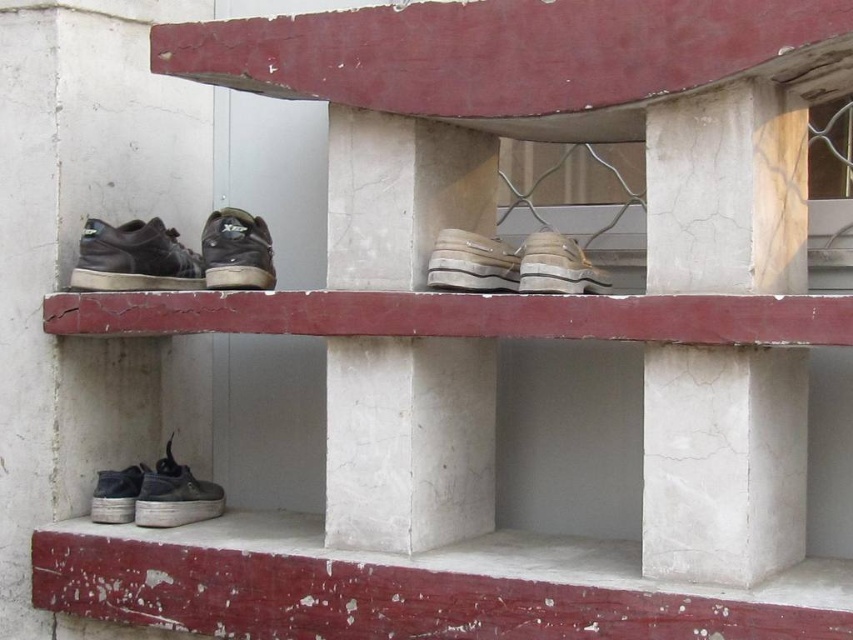
Between point (161, 250) and point (167, 524), which one is positioned behind?

Point (161, 250)

Consider the image. Is matte black shoe at left smaller than shiny black shoe at lower left?

No, matte black shoe at left is not smaller than shiny black shoe at lower left.

Between point (161, 269) and point (171, 516), which one is positioned in front?

Point (171, 516)

The image size is (853, 640). What are the coordinates of `matte black shoe at left` in the screenshot? It's located at (134, 259).

Can you confirm if worn leather shoe at center is smaller than shiny black shoe at lower left?

Yes, worn leather shoe at center is smaller than shiny black shoe at lower left.

Between worn leather shoe at center and shiny black shoe at lower left, which one has more height?

shiny black shoe at lower left

Which is behind, point (467, 275) or point (198, 508)?

Positioned behind is point (198, 508).

Find the location of `worn leather shoe at center`. worn leather shoe at center is located at coordinates (473, 262).

Is worn leather shoe at center shorter than dark gray suede shoe at lower left?

Incorrect, worn leather shoe at center's height does not fall short of dark gray suede shoe at lower left's.

Is worn leather shoe at center bigger than dark gray suede shoe at lower left?

Yes, worn leather shoe at center is bigger than dark gray suede shoe at lower left.

What do you see at coordinates (473, 262) in the screenshot? Image resolution: width=853 pixels, height=640 pixels. I see `worn leather shoe at center` at bounding box center [473, 262].

The image size is (853, 640). I want to click on worn leather shoe at center, so click(x=473, y=262).